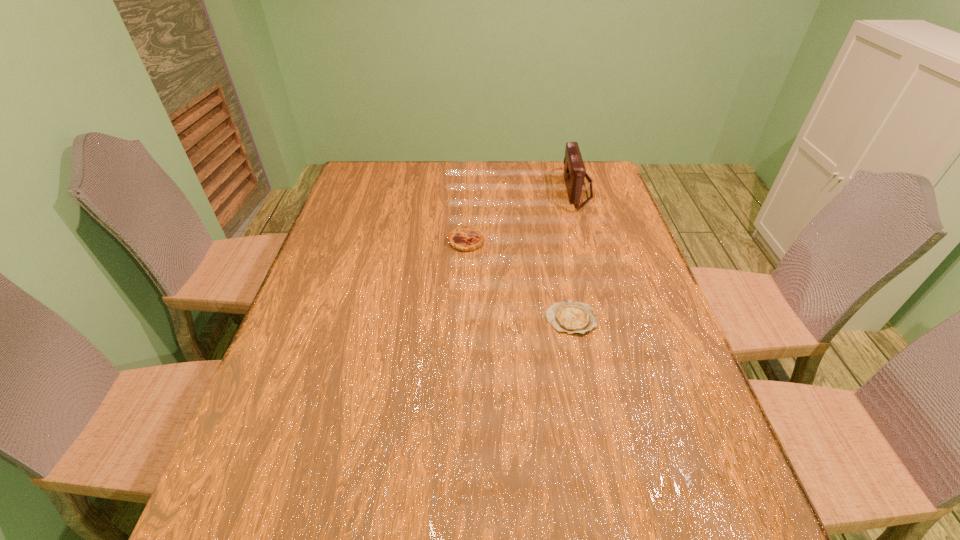
This screenshot has width=960, height=540. Identify the location of blank area in the image that satisfies the following two spatial constraints: 1. on the front flap of the shoulder bag; 2. on the front side of the leftmost object. (592, 241).

Find the location of a particular element. The width and height of the screenshot is (960, 540). free space that satisfies the following two spatial constraints: 1. on the front flap of the tallest object; 2. on the front side of the second nearest object is located at coordinates (592, 241).